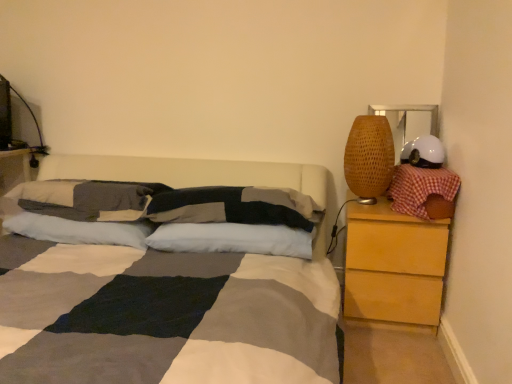
In order to face woven bamboo lampshade at right, should I rotate leftwards or rightwards?

To align with it, rotate right about 14.760°.

What do you see at coordinates (423, 152) in the screenshot? I see `white matte helmet at upper right` at bounding box center [423, 152].

Locate an element on the screen. The image size is (512, 384). textured cotton pillow at center, which is the fourth pillow from right to left is located at coordinates (89, 199).

Which object is positioned more to the left, light brown wood chest of drawers at right or textured gray pillow at center, acting as the third pillow starting from the right?

textured gray pillow at center, acting as the third pillow starting from the right.

Who is more distant, light brown wood chest of drawers at right or textured gray pillow at center, acting as the 3th pillow starting from the left?

light brown wood chest of drawers at right is further away from the camera.

From the light brown wood chest of drawers at right, count the 2nd pillow to the left and point to it. Please provide its 2D coordinates.

[(228, 207)]

What's the angular difference between white matte helmet at upper right and textured gray pillow at center, acting as the third pillow starting from the right,'s facing directions?

The angular difference between white matte helmet at upper right and textured gray pillow at center, acting as the third pillow starting from the right, is 2.27 degrees.

Is white matte helmet at upper right facing towards textured gray pillow at center, acting as the third pillow starting from the right?

No, white matte helmet at upper right is not oriented towards textured gray pillow at center, acting as the third pillow starting from the right.

I want to click on helmet above the textured gray pillow at center, acting as the third pillow starting from the right (from the image's perspective), so click(x=423, y=152).

Is white matte helmet at upper right next to textured gray pillow at center, acting as the third pillow starting from the right, and touching it?

They are not placed beside each other.

From a real-world perspective, which is physically above, woven bamboo lampshade at right or white matte helmet at upper right?

white matte helmet at upper right.

Locate an element on the screen. table lamp on the left of white matte helmet at upper right is located at coordinates (369, 158).

Is white matte helmet at upper right at the back of woven bamboo lampshade at right?

No, woven bamboo lampshade at right is not facing the opposite direction of white matte helmet at upper right.

Who is taller, woven bamboo lampshade at right or textured gray pillow at center, acting as the third pillow starting from the right?

With more height is woven bamboo lampshade at right.

What's the angular difference between woven bamboo lampshade at right and textured gray pillow at center, acting as the 3th pillow starting from the left,'s facing directions?

2.27 degrees separate the facing orientations of woven bamboo lampshade at right and textured gray pillow at center, acting as the 3th pillow starting from the left.

Is woven bamboo lampshade at right aimed at textured gray pillow at center, acting as the 3th pillow starting from the left?

No, woven bamboo lampshade at right is not turned towards textured gray pillow at center, acting as the 3th pillow starting from the left.

Is textured cotton pillow at center, the second pillow viewed from the left, located outside textured gray pillow at center, acting as the third pillow starting from the right?

textured cotton pillow at center, the second pillow viewed from the left, is positioned outside textured gray pillow at center, acting as the third pillow starting from the right.

From a real-world perspective, is textured cotton pillow at center, which is the fourth pillow from right to left, beneath textured gray pillow at center, acting as the 3th pillow starting from the left?

Yes.

Is textured cotton pillow at center, which is the fourth pillow from right to left, oriented towards textured gray pillow at center, acting as the 3th pillow starting from the left?

No, textured cotton pillow at center, which is the fourth pillow from right to left, is not facing towards textured gray pillow at center, acting as the 3th pillow starting from the left.

Does textured cotton pillow at center, which is the fourth pillow from right to left, appear on the left side of textured gray pillow at center, acting as the 3th pillow starting from the left?

Indeed, textured cotton pillow at center, which is the fourth pillow from right to left, is positioned on the left side of textured gray pillow at center, acting as the 3th pillow starting from the left.

Does white soft pillow at center, the 5th pillow viewed from the right, turn towards white soft pillow at center, acting as the second pillow starting from the right?

No, white soft pillow at center, the 5th pillow viewed from the right, is not aimed at white soft pillow at center, acting as the second pillow starting from the right.

Can you tell me how much white soft pillow at center, the 5th pillow viewed from the right, and white soft pillow at center, which is the fourth pillow from left to right, differ in facing direction?

There is a 5.31-degree angle between the facing directions of white soft pillow at center, the 5th pillow viewed from the right, and white soft pillow at center, which is the fourth pillow from left to right.

Considering the sizes of objects white soft pillow at center, arranged as the 1th pillow when viewed from the left, and white soft pillow at center, which is the fourth pillow from left to right, in the image provided, who is taller, white soft pillow at center, arranged as the 1th pillow when viewed from the left, or white soft pillow at center, which is the fourth pillow from left to right,?

white soft pillow at center, arranged as the 1th pillow when viewed from the left, is taller.

Are red checkered pillow at right, the 1th pillow in the right-to-left sequence, and white soft pillow at center, acting as the second pillow starting from the right, located far from each other?

No, red checkered pillow at right, the 1th pillow in the right-to-left sequence, is not far away from white soft pillow at center, acting as the second pillow starting from the right.

Between point (454, 194) and point (277, 231), which one is positioned behind?

The point (277, 231) is farther.

Is the depth of red checkered pillow at right, the 1th pillow in the right-to-left sequence, less than that of white soft pillow at center, which is the fourth pillow from left to right?

That is True.

From the image's perspective, would you say red checkered pillow at right, which appears as the 5th pillow when viewed from the left, is shown under white soft pillow at center, acting as the second pillow starting from the right?

Incorrect, from the image's perspective, red checkered pillow at right, which appears as the 5th pillow when viewed from the left, is higher than white soft pillow at center, acting as the second pillow starting from the right.

Locate an element on the screen. the chest of drawers behind the textured gray pillow at center, acting as the third pillow starting from the right is located at coordinates (394, 265).

Find the location of a particular element. helmet on the right of the textured gray pillow at center, acting as the third pillow starting from the right is located at coordinates tap(423, 152).

Estimate the real-world distances between objects in this image. Which object is closer to white soft pillow at center, which is the fourth pillow from left to right, light brown wood chest of drawers at right or woven bamboo lampshade at right?

The object closer to white soft pillow at center, which is the fourth pillow from left to right, is light brown wood chest of drawers at right.

When comparing their distances from textured gray pillow at center, acting as the 3th pillow starting from the left, does red checkered pillow at right, the 1th pillow in the right-to-left sequence, or light brown wood chest of drawers at right seem closer?

light brown wood chest of drawers at right.

Looking at the image, which one is located closer to white soft pillow at center, which is the fourth pillow from left to right, woven bamboo lampshade at right or textured cotton pillow at center, the second pillow viewed from the left?

textured cotton pillow at center, the second pillow viewed from the left, lies closer to white soft pillow at center, which is the fourth pillow from left to right, than the other object.

Considering their positions, is woven bamboo lampshade at right positioned closer to white soft pillow at center, acting as the second pillow starting from the right, than white matte helmet at upper right?

woven bamboo lampshade at right is closer to white soft pillow at center, acting as the second pillow starting from the right.

Looking at the image, which one is located closer to white soft pillow at center, arranged as the 1th pillow when viewed from the left, textured gray pillow at center, acting as the 3th pillow starting from the left, or white soft pillow at center, acting as the second pillow starting from the right?

white soft pillow at center, acting as the second pillow starting from the right, is closer to white soft pillow at center, arranged as the 1th pillow when viewed from the left.

When comparing their distances from white soft pillow at center, the 5th pillow viewed from the right, does light brown wood chest of drawers at right or woven bamboo lampshade at right seem further?

Based on the image, light brown wood chest of drawers at right appears to be further to white soft pillow at center, the 5th pillow viewed from the right.

When comparing their distances from white soft pillow at center, the 5th pillow viewed from the right, does red checkered pillow at right, the 1th pillow in the right-to-left sequence, or white matte helmet at upper right seem closer?

The object closer to white soft pillow at center, the 5th pillow viewed from the right, is red checkered pillow at right, the 1th pillow in the right-to-left sequence.

Looking at the image, which one is located closer to white matte helmet at upper right, woven bamboo lampshade at right or light brown wood chest of drawers at right?

woven bamboo lampshade at right lies closer to white matte helmet at upper right than the other object.

I want to click on chest of drawers between textured gray pillow at center, acting as the third pillow starting from the right, and red checkered pillow at right, the 1th pillow in the right-to-left sequence, from left to right, so click(394, 265).

Identify the location of table lamp located between white soft pillow at center, acting as the second pillow starting from the right, and red checkered pillow at right, which appears as the 5th pillow when viewed from the left, in the left-right direction. (369, 158).

Where is `table lamp between textured gray pillow at center, acting as the third pillow starting from the right, and white matte helmet at upper right`? table lamp between textured gray pillow at center, acting as the third pillow starting from the right, and white matte helmet at upper right is located at coordinates (369, 158).

Locate an element on the screen. Image resolution: width=512 pixels, height=384 pixels. table lamp located between white soft pillow at center, arranged as the 1th pillow when viewed from the left, and light brown wood chest of drawers at right in the left-right direction is located at coordinates (369, 158).